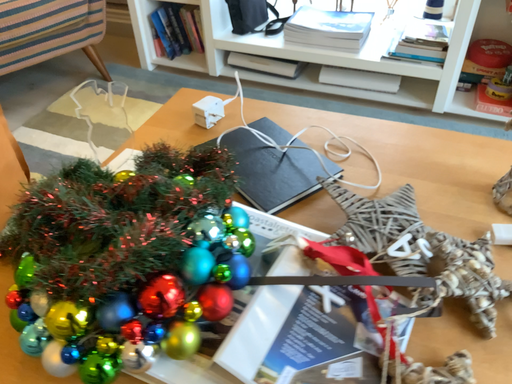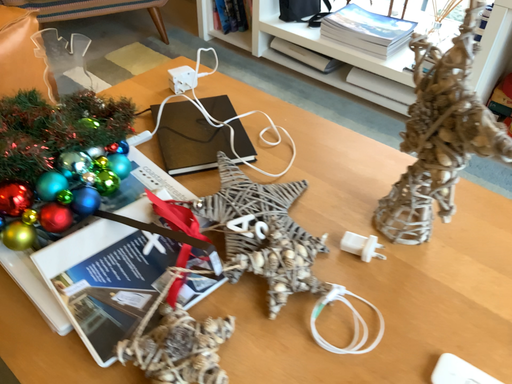
Question: Which way did the camera rotate in the video?

Choices:
 (A) rotated right
 (B) rotated left

Answer: (B)